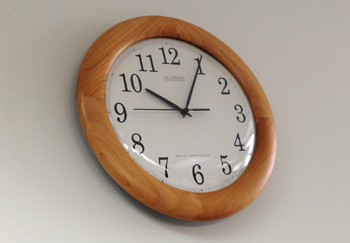
The image size is (350, 243). Find the location of `centre of clock`. centre of clock is located at coordinates (183, 112).